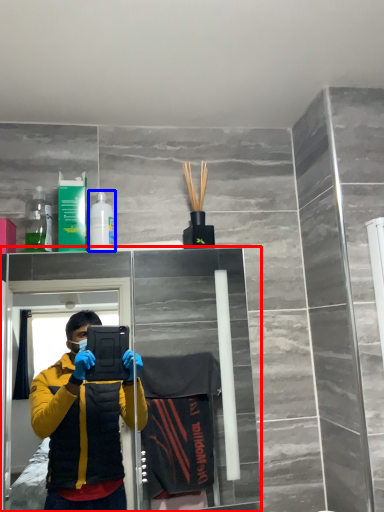
Question: Which of the following is the closest to the observer, glass door (highlighted by a red box) or toiletry (highlighted by a blue box)?

Choices:
 (A) glass door
 (B) toiletry

Answer: (A)